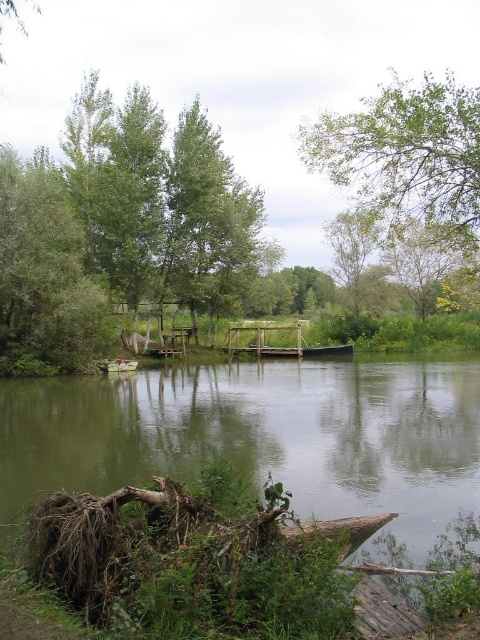
You are standing on the dock and looking at the green wood lake at center and the green leafy tree at upper center. Which object appears taller from your perspective?

The green leafy tree at upper center appears taller than the green wood lake at center because the green wood lake at center has a lesser height compared to the green leafy tree at upper center.

You are navigating a small boat on the green wood lake at center. If you head directly towards the point marked at coordinates 0.684, 0.548, will you reach the center of the lake?

The green wood lake at center is located at point (263, 436), so heading directly towards those coordinates will lead you to the center of the lake.